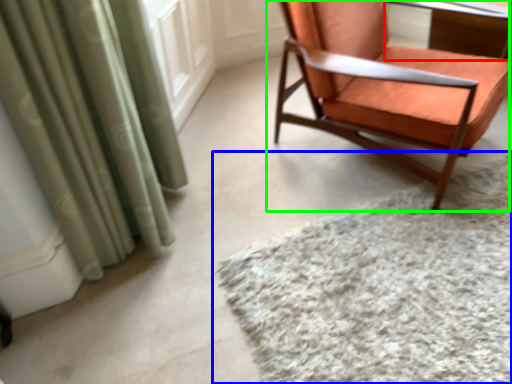
Question: Estimate the real-world distances between objects in this image. Which object is farther from table (highlighted by a red box), mat (highlighted by a blue box) or chair (highlighted by a green box)?

Choices:
 (A) mat
 (B) chair

Answer: (A)